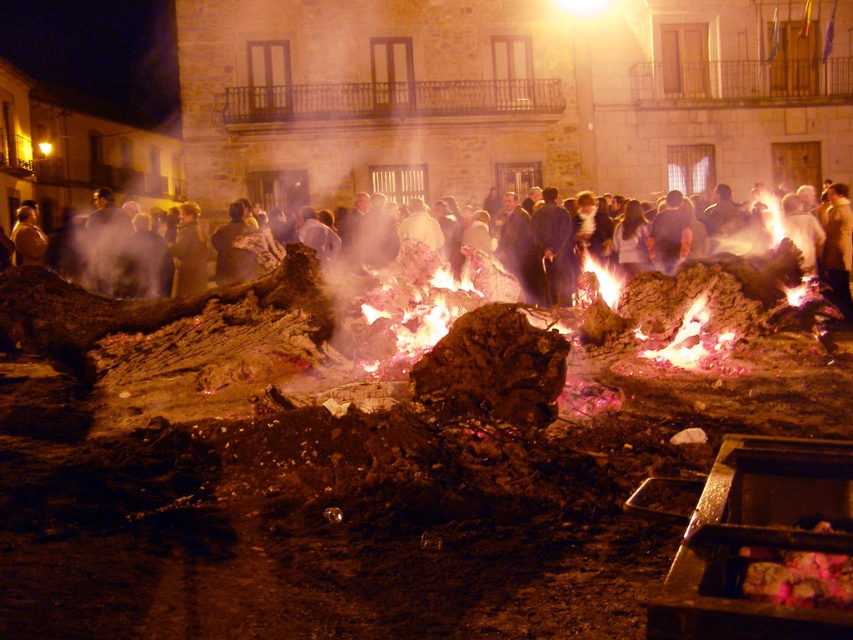
Based on the photo, is charcoal ash fire pit at lower right behind white cotton dress at center?

No, it is in front of white cotton dress at center.

Does charcoal ash fire pit at lower right appear under white cotton dress at center?

Indeed, charcoal ash fire pit at lower right is positioned under white cotton dress at center.

Does point (711, 522) come closer to viewer compared to point (813, 228)?

Yes, point (711, 522) is in front of point (813, 228).

Identify the location of charcoal ash fire pit at lower right. The width and height of the screenshot is (853, 640). (756, 540).

Where is `white cotton dress at center`? The height and width of the screenshot is (640, 853). white cotton dress at center is located at coordinates (822, 241).

Is charcoal ash fire pit at lower right bigger than charred wood at center?

No.

Measure the distance between point (773, 445) and camera.

Point (773, 445) and camera are 3.46 meters apart from each other.

Where is `charcoal ash fire pit at lower right`? charcoal ash fire pit at lower right is located at coordinates pos(756,540).